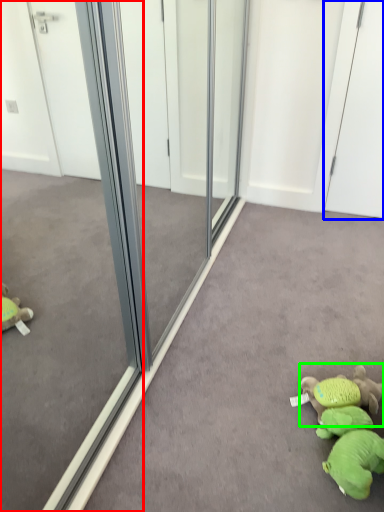
Question: Which is farther away from glass door (highlighted by a red box)? screen door (highlighted by a blue box) or toy (highlighted by a green box)?

Choices:
 (A) screen door
 (B) toy

Answer: (A)